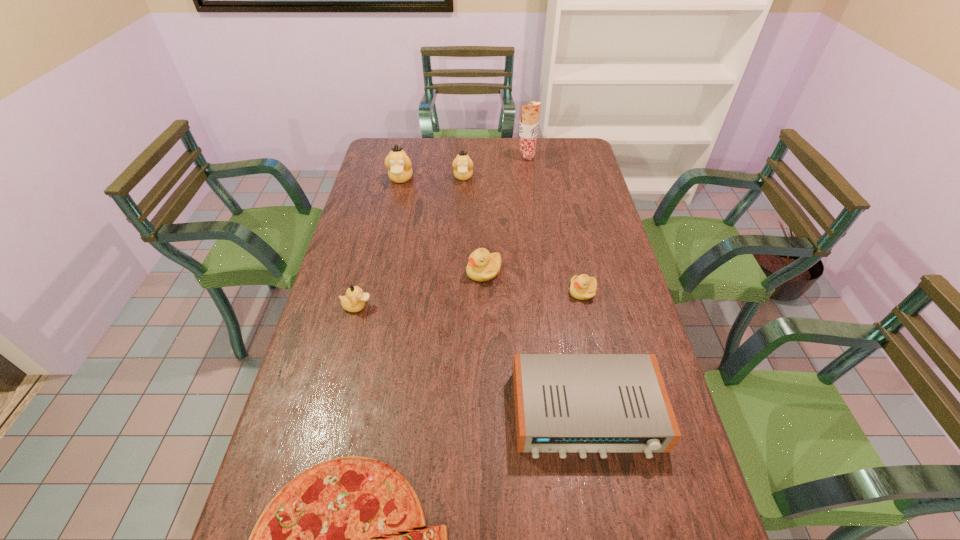
The image size is (960, 540). Find the location of `duckling that is the third closest to the farthest object`. duckling that is the third closest to the farthest object is located at coordinates (482, 266).

Point out which tan duckling is positioned as the second nearest to the rightmost duckling. Please provide its 2D coordinates. Your answer should be formatted as a tuple, i.e. [(x, y)], where the tuple contains the x and y coordinates of a point satisfying the conditions above.

[(463, 166)]

Select which tan duckling is the third closest to the radio receiver. Please provide its 2D coordinates. Your answer should be formatted as a tuple, i.e. [(x, y)], where the tuple contains the x and y coordinates of a point satisfying the conditions above.

[(399, 165)]

What are the coordinates of `vacant space that satisfies the following two spatial constraints: 1. on the beak of the smaller yellow duckling; 2. on the control panel of the radio receiver` in the screenshot? It's located at (609, 414).